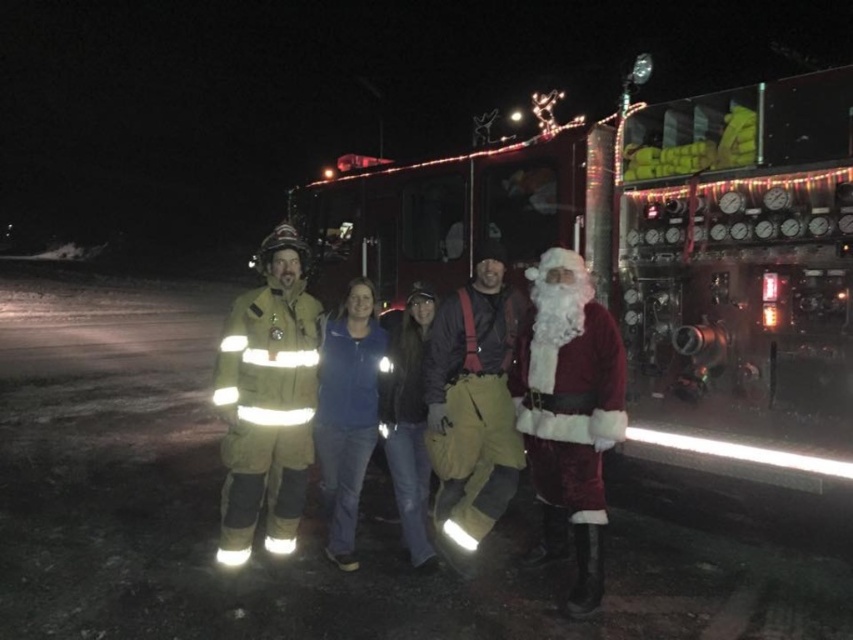
Is reflective yellow-green fireman suit at center positioned at the back of fuzzy white beard at center?

That is False.

Is reflective yellow-green fireman suit at center below fuzzy white beard at center?

Actually, reflective yellow-green fireman suit at center is above fuzzy white beard at center.

What do you see at coordinates (267, 401) in the screenshot?
I see `reflective yellow-green fireman suit at center` at bounding box center [267, 401].

Where is `reflective yellow-green fireman suit at center`? reflective yellow-green fireman suit at center is located at coordinates (267, 401).

Can you confirm if velvet red santa at right is thinner than blue fleece jacket at center?

In fact, velvet red santa at right might be wider than blue fleece jacket at center.

You are a GUI agent. You are given a task and a screenshot of the screen. Output one action in this format:
    pyautogui.click(x=<x>, y=<y>)
    Task: Click on the velvet red santa at right
    
    Given the screenshot: What is the action you would take?
    pyautogui.click(x=569, y=413)

Which is behind, point (549, 364) or point (331, 419)?

Positioned behind is point (331, 419).

The height and width of the screenshot is (640, 853). Identify the location of velvet red santa at right. pyautogui.click(x=569, y=413).

Does point (405, 227) lie behind point (328, 458)?

Yes, it is.

Is red reflective fire truck at center to the left of blue fleece jacket at center from the viewer's perspective?

No, red reflective fire truck at center is not to the left of blue fleece jacket at center.

Does point (660, 412) come closer to viewer compared to point (351, 410)?

That is False.

This screenshot has height=640, width=853. I want to click on red reflective fire truck at center, so click(x=656, y=259).